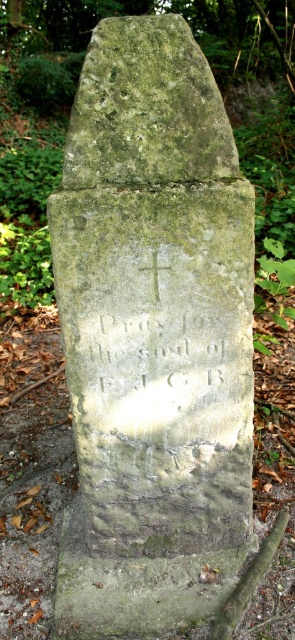
You are an archaeologist examining the stone monument. You notice the carved stone inscription at center and the white stone cross at center. Which object is closer to you?

The carved stone inscription at center is closer to you than the white stone cross at center because it is further to the viewer.

You are a photographer standing in front of the green stone gravestone at center. You want to take a clear photo of the inscription. Considering the distance, will you need to adjust your camera focus to capture the gravestone clearly?

The green stone gravestone at center is 1.68 meters away from the camera. Since this distance is within typical camera focus ranges, you do not need to adjust the focus beyond standard settings to capture the gravestone clearly.